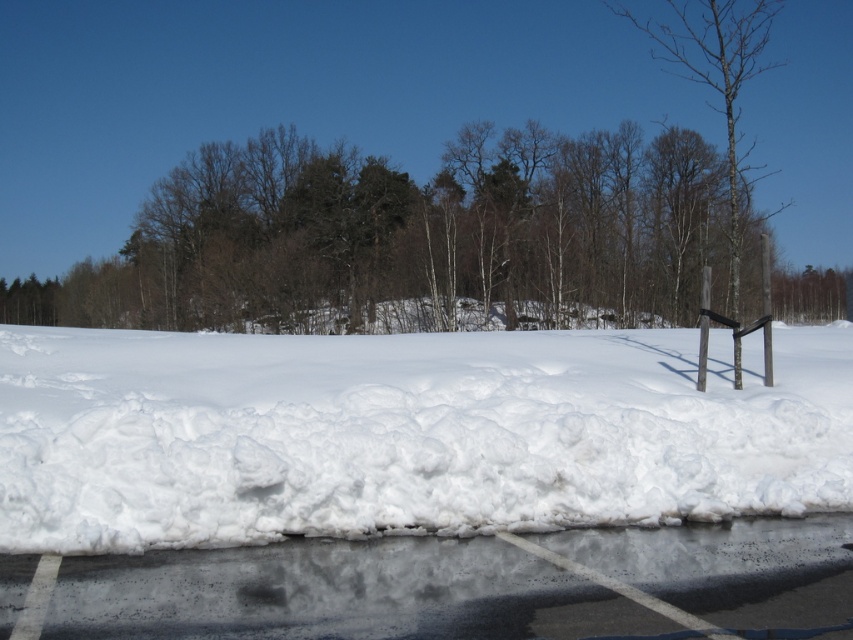
You are a snowplow operator needing to clear the snow from the parking lot. You see the white fluffy snow at center and the black asphalt at lower center. Which area requires more effort to clear based on their sizes?

The white fluffy snow at center requires more effort to clear because it is larger in size than the black asphalt at lower center.

Looking at this image, you are standing on the black asphalt at lower center and want to walk to the white fluffy snow at center. Which direction should you move in?

You should move to your right because the white fluffy snow at center is located to the right of the black asphalt at lower center.

Based on the photo, you are standing at the edge of the snowbank near the asphalt parking lot in the winter scene. You notice two points marked on the image. One is at coordinate point [459,416] and the other at point [115,634]. If you were to walk from the snowbank towards the parking lot, which point would you encounter first?

Point [115,634] would be encountered first because it is in front of point [459,416] according to their spatial arrangement in the image.